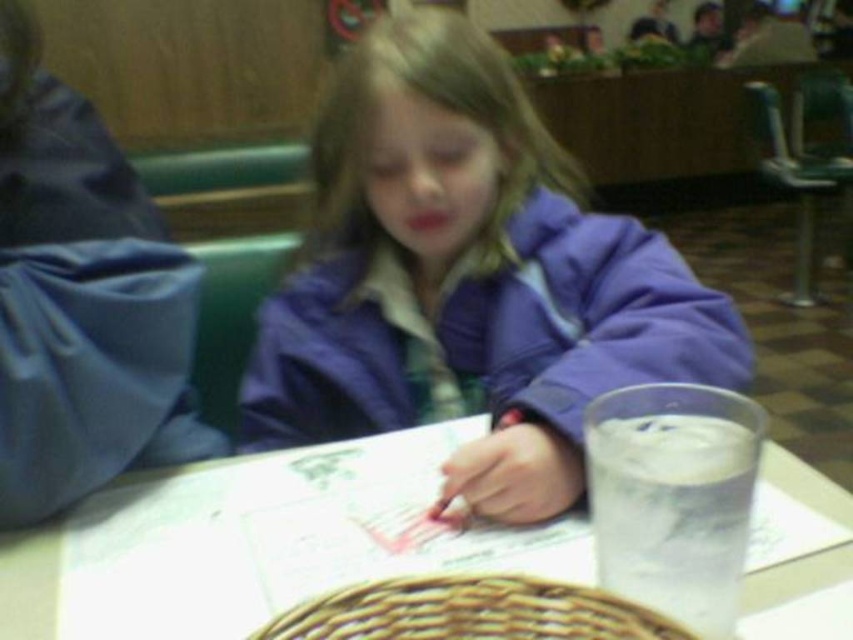
Which is more to the right, purple matte jacket at center or white glossy table at center?

purple matte jacket at center is more to the right.

Is purple matte jacket at center positioned before white glossy table at center?

No.

Does point (320, 172) come farther from viewer compared to point (38, 564)?

That is True.

Find the location of a particular element. The height and width of the screenshot is (640, 853). purple matte jacket at center is located at coordinates (467, 276).